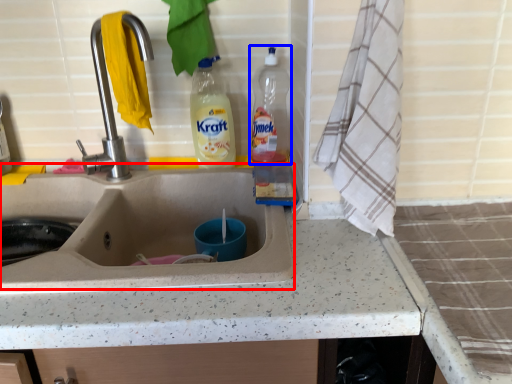
Question: Which object appears closest to the camera in this image, sink (highlighted by a red box) or bottle (highlighted by a blue box)?

Choices:
 (A) sink
 (B) bottle

Answer: (A)